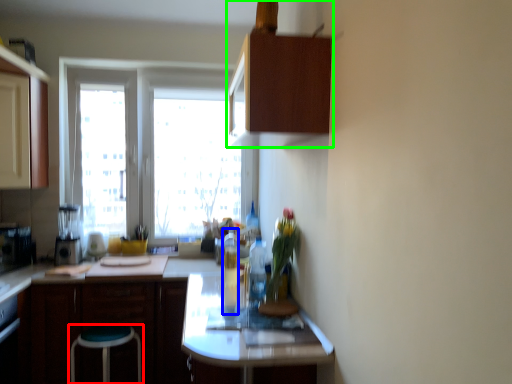
Question: Based on their relative distances, which object is farther from stool (highlighted by a red box)? Choose from bottle (highlighted by a blue box) and cabinetry (highlighted by a green box).

Choices:
 (A) bottle
 (B) cabinetry

Answer: (B)